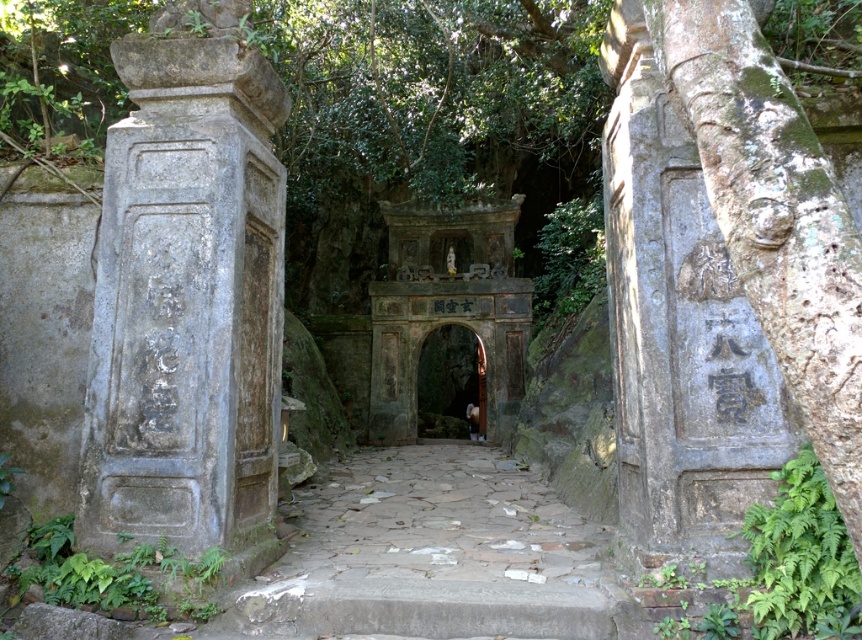
You are a tourist standing at the entrance of the ancient stone structure. You want to take a photo of the gray stone pillar at center and the stone paved path at center. Which object should you focus on first if you want to capture both in a single frame without moving the camera?

The gray stone pillar at center is to the right of the stone paved path at center, so you should focus on the stone paved path at center first to ensure both are in the frame.

Consider the image. You are a hiker who has reached the entrance of the ancient stone structure. You notice the gray stone pillar at center and the green leafy plant at lower left. Which object is positioned higher from the ground?

The gray stone pillar at center is above the green leafy plant at lower left, so the gray stone pillar at center is positioned higher from the ground.

You are a visitor approaching the ancient stone structure and want to take a photo of the gray stone pillar at center and the green leafy plant at lower left. Which object should you focus on first if you want to capture both in the same frame without moving your camera?

The gray stone pillar at center is positioned on the right side of green leafy plant at lower left, so you should focus on the green leafy plant at lower left first to ensure both are in frame.